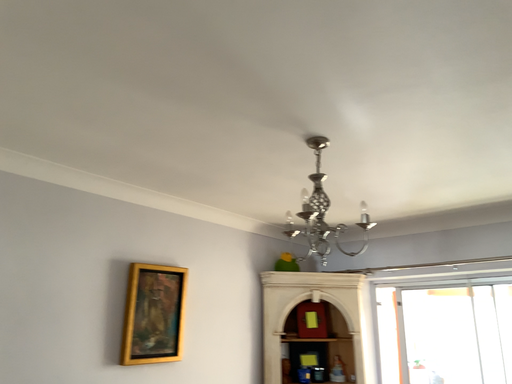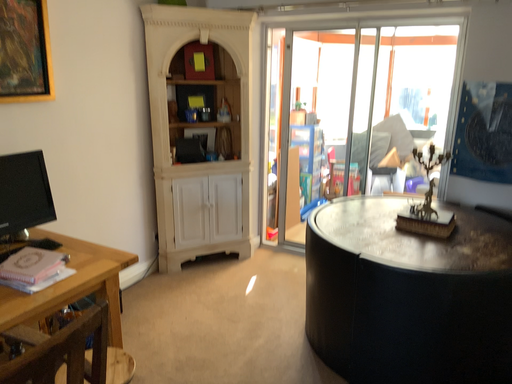
Question: Which way did the camera rotate in the video?

Choices:
 (A) rotated downward
 (B) rotated upward

Answer: (A)